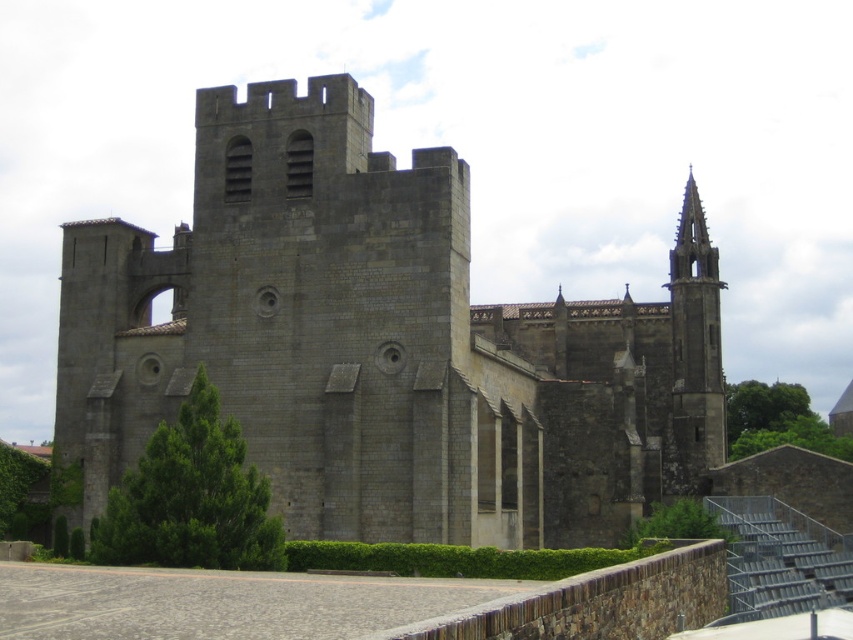
Question: Can you confirm if gray stone castle at center is positioned above smooth gray spire at upper right?

Choices:
 (A) no
 (B) yes

Answer: (B)

Question: Is gray stone castle at center positioned behind smooth gray spire at upper right?

Choices:
 (A) yes
 (B) no

Answer: (B)

Question: Which of the following is the farthest from the observer?

Choices:
 (A) smooth gray spire at upper right
 (B) gray stone castle at center

Answer: (A)

Question: Which object appears farthest from the camera in this image?

Choices:
 (A) smooth gray spire at upper right
 (B) gray stone castle at center

Answer: (A)

Question: From the image, what is the correct spatial relationship of gray stone castle at center in relation to smooth gray spire at upper right?

Choices:
 (A) above
 (B) below

Answer: (A)